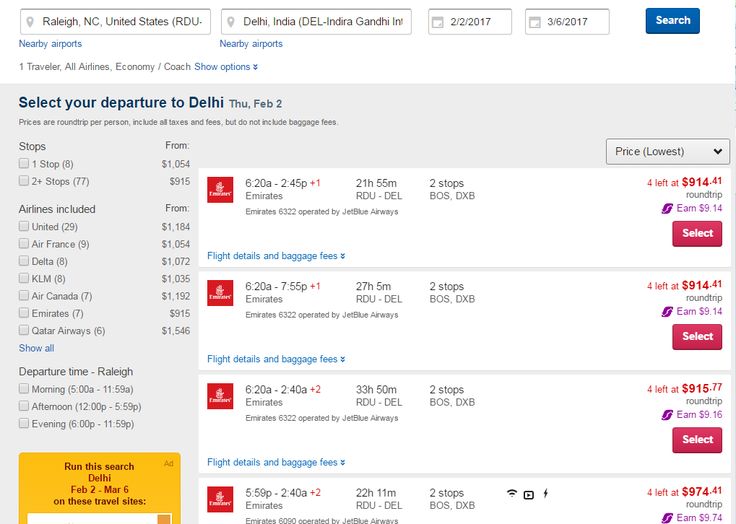
Identify the location of calendar. This screenshot has height=524, width=736. (464, 23).